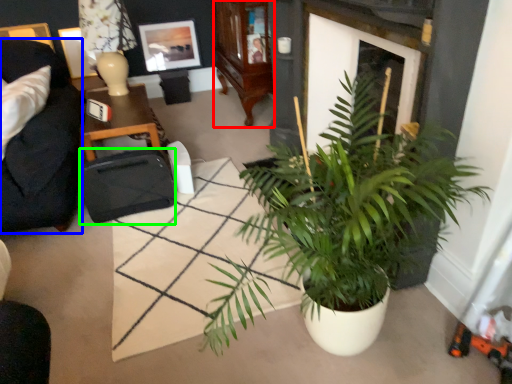
Question: Estimate the real-world distances between objects in this image. Which object is closer to cabinetry (highlighted by a red box), studio couch (highlighted by a blue box) or luggage and bags (highlighted by a green box)?

Choices:
 (A) studio couch
 (B) luggage and bags

Answer: (B)